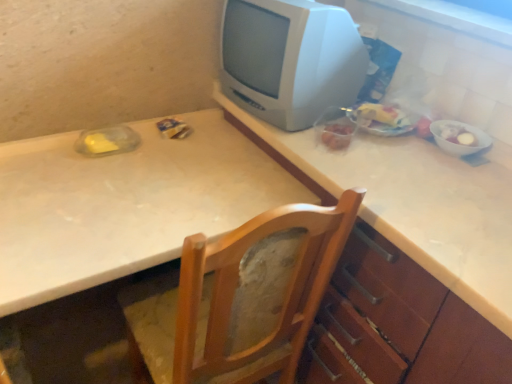
What do you see at coordinates (243, 298) in the screenshot?
I see `wooden chair at center` at bounding box center [243, 298].

What do you see at coordinates (124, 204) in the screenshot?
I see `white laminate table at center` at bounding box center [124, 204].

I want to click on white laminate table at center, so click(x=124, y=204).

What do you see at coordinates (381, 115) in the screenshot? The width and height of the screenshot is (512, 384). I see `translucent plastic bag of food at right, positioned as the 2th food in right-to-left order` at bounding box center [381, 115].

I want to click on translucent plastic bag of food at right, arranged as the first food when viewed from the left, so [381, 115].

Identify the location of wooden chair at center. (243, 298).

Based on the photo, is white glossy counter top at upper center smaller than wooden chair at center?

Actually, white glossy counter top at upper center might be larger than wooden chair at center.

Which point is more distant from viewer, (423,264) or (174,320)?

The point (174,320) is farther.

Is white glossy counter top at upper center turned away from wooden chair at center?

Correct, white glossy counter top at upper center is looking away from wooden chair at center.

Is white glossy counter top at upper center at the right side of wooden chair at center?

Correct, you'll find white glossy counter top at upper center to the right of wooden chair at center.

Does wooden chair at center appear on the right side of white glossy counter top at upper center?

No.

Could you tell me if wooden chair at center is turned towards white glossy counter top at upper center?

No, wooden chair at center does not turn towards white glossy counter top at upper center.

Considering the relative sizes of wooden chair at center and white glossy counter top at upper center in the image provided, is wooden chair at center shorter than white glossy counter top at upper center?

Incorrect, the height of wooden chair at center does not fall short of that of white glossy counter top at upper center.

Considering the sizes of objects wooden chair at center and white glossy counter top at upper center in the image provided, who is smaller, wooden chair at center or white glossy counter top at upper center?

With smaller size is wooden chair at center.

From the image's perspective, between translucent plastic bag of food at right, arranged as the first food when viewed from the left, and white glossy counter top at upper center, who is located below?

From the image's view, white glossy counter top at upper center is below.

Looking at this image, would you say translucent plastic bag of food at right, arranged as the first food when viewed from the left, is inside or outside white glossy counter top at upper center?

translucent plastic bag of food at right, arranged as the first food when viewed from the left, exists outside the volume of white glossy counter top at upper center.

Is point (369, 110) less distant than point (362, 208)?

No, it is behind (362, 208).

Are translucent plastic bag of food at right, positioned as the 2th food in right-to-left order, and white glossy counter top at upper center located far from each other?

They are positioned close to each other.

From the image's perspective, which is below, white glossy bowl at right, arranged as the first food when viewed from the right, or white glossy counter top at upper center?

white glossy counter top at upper center is shown below in the image.

From a real-world perspective, between white glossy bowl at right, arranged as the first food when viewed from the right, and white glossy counter top at upper center, who is vertically lower?

From a 3D spatial view, white glossy counter top at upper center is below.

Which object is more forward, white glossy bowl at right, arranged as the first food when viewed from the right, or white glossy counter top at upper center?

Positioned in front is white glossy counter top at upper center.

Consider the image. From a real-world perspective, which is physically below, white glossy counter top at upper center or white glossy window sill at upper right?

white glossy counter top at upper center is physically lower.

Looking at their sizes, would you say white glossy counter top at upper center is wider or thinner than white glossy window sill at upper right?

Clearly, white glossy counter top at upper center has more width compared to white glossy window sill at upper right.

Does white glossy counter top at upper center contain white glossy window sill at upper right?

Definitely not — white glossy window sill at upper right is not inside white glossy counter top at upper center.

Is there a large distance between white glossy counter top at upper center and white glossy window sill at upper right?

No, white glossy counter top at upper center is in close proximity to white glossy window sill at upper right.

Considering the sizes of objects translucent plastic bag of food at right, positioned as the 2th food in right-to-left order, and white plastic television at upper right in the image provided, who is smaller, translucent plastic bag of food at right, positioned as the 2th food in right-to-left order, or white plastic television at upper right?

Smaller between the two is translucent plastic bag of food at right, positioned as the 2th food in right-to-left order.

Does translucent plastic bag of food at right, arranged as the first food when viewed from the left, turn towards white plastic television at upper right?

No, translucent plastic bag of food at right, arranged as the first food when viewed from the left, is not facing towards white plastic television at upper right.

Considering the positions of objects translucent plastic bag of food at right, positioned as the 2th food in right-to-left order, and white plastic television at upper right in the image provided, who is behind, translucent plastic bag of food at right, positioned as the 2th food in right-to-left order, or white plastic television at upper right?

translucent plastic bag of food at right, positioned as the 2th food in right-to-left order, is behind.

Choose the correct answer: Is translucent plastic bag of food at right, positioned as the 2th food in right-to-left order, inside white plastic television at upper right or outside it?

translucent plastic bag of food at right, positioned as the 2th food in right-to-left order, is outside white plastic television at upper right.

Would you say white laminate table at center is inside or outside white glossy bowl at right, arranged as the first food when viewed from the right?

white laminate table at center cannot be found inside white glossy bowl at right, arranged as the first food when viewed from the right.

Is white laminate table at center far from white glossy bowl at right, arranged as the first food when viewed from the right?

No, white laminate table at center is in close proximity to white glossy bowl at right, arranged as the first food when viewed from the right.

Considering the points (11, 230) and (453, 142), which point is in front, point (11, 230) or point (453, 142)?

The point (11, 230) is closer to the camera.

The width and height of the screenshot is (512, 384). What are the coordinates of `chair that is in front of the white glossy counter top at upper center` in the screenshot? It's located at (243, 298).

Where is `chair below the white glossy counter top at upper center (from the image's perspective)`? chair below the white glossy counter top at upper center (from the image's perspective) is located at coordinates (243, 298).

When comparing their distances from translucent plastic bag of food at right, positioned as the 2th food in right-to-left order, does wooden chair at center or white glossy counter top at upper center seem closer?

The object closer to translucent plastic bag of food at right, positioned as the 2th food in right-to-left order, is white glossy counter top at upper center.

Consider the image. Looking at the image, which one is located closer to translucent plastic bag of food at right, arranged as the first food when viewed from the left, white laminate table at center or wooden chair at center?

white laminate table at center lies closer to translucent plastic bag of food at right, arranged as the first food when viewed from the left, than the other object.

Which object lies nearer to the anchor point white laminate table at center, white plastic television at upper right or wooden chair at center?

wooden chair at center is positioned closer to the anchor white laminate table at center.

Estimate the real-world distances between objects in this image. Which object is further from translucent plastic bag of food at right, arranged as the first food when viewed from the left, white glossy counter top at upper center or white glossy bowl at right, which is the 2th food in left-to-right order?

The object further to translucent plastic bag of food at right, arranged as the first food when viewed from the left, is white glossy counter top at upper center.

When comparing their distances from white glossy window sill at upper right, does white glossy bowl at right, arranged as the first food when viewed from the right, or translucent plastic bag of food at right, arranged as the first food when viewed from the left, seem further?

white glossy bowl at right, arranged as the first food when viewed from the right, is positioned further to the anchor white glossy window sill at upper right.

Based on the photo, which object lies further to the anchor point white glossy bowl at right, which is the 2th food in left-to-right order, wooden chair at center or white plastic television at upper right?

wooden chair at center is positioned further to the anchor white glossy bowl at right, which is the 2th food in left-to-right order.

From the image, which object appears to be nearer to white plastic television at upper right, white glossy bowl at right, arranged as the first food when viewed from the right, or translucent plastic bag of food at right, arranged as the first food when viewed from the left?

translucent plastic bag of food at right, arranged as the first food when viewed from the left, is closer to white plastic television at upper right.

Consider the image. Considering their positions, is white glossy bowl at right, arranged as the first food when viewed from the right, positioned closer to translucent plastic bag of food at right, arranged as the first food when viewed from the left, than white plastic television at upper right?

white glossy bowl at right, arranged as the first food when viewed from the right, lies closer to translucent plastic bag of food at right, arranged as the first food when viewed from the left, than the other object.

Where is `counter top between white plastic television at upper right and wooden chair at center from top to bottom`? counter top between white plastic television at upper right and wooden chair at center from top to bottom is located at coordinates (419, 204).

Identify the location of food between wooden chair at center and white glossy bowl at right, arranged as the first food when viewed from the right, from left to right. (381, 115).

The width and height of the screenshot is (512, 384). In order to click on food between white laminate table at center and white glossy window sill at upper right in this screenshot , I will do `click(381, 115)`.

You are a GUI agent. You are given a task and a screenshot of the screen. Output one action in this format:
    pyautogui.click(x=<x>, y=<y>)
    Task: Click on the food positioned between white glossy counter top at upper center and translucent plastic bag of food at right, positioned as the 2th food in right-to-left order, from near to far
    Image resolution: width=512 pixels, height=384 pixels.
    Given the screenshot: What is the action you would take?
    pyautogui.click(x=457, y=135)